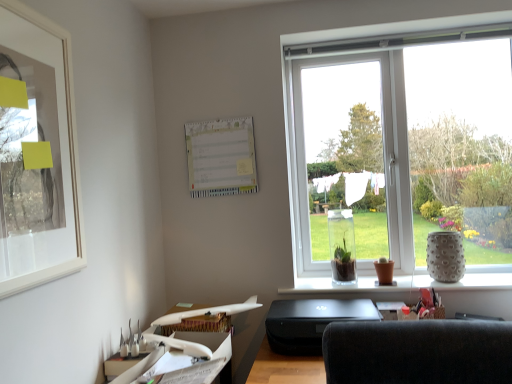
Question: Can you confirm if white plastic airplane at lower left is smaller than speckled ceramic vase at right?

Choices:
 (A) yes
 (B) no

Answer: (B)

Question: Is white plastic airplane at lower left in contact with speckled ceramic vase at right?

Choices:
 (A) no
 (B) yes

Answer: (A)

Question: Is white plastic airplane at lower left taller than speckled ceramic vase at right?

Choices:
 (A) yes
 (B) no

Answer: (B)

Question: Is white plastic airplane at lower left turned away from speckled ceramic vase at right?

Choices:
 (A) no
 (B) yes

Answer: (A)

Question: From a real-world perspective, is white plastic airplane at lower left located beneath speckled ceramic vase at right?

Choices:
 (A) no
 (B) yes

Answer: (B)

Question: From a real-world perspective, is white plastic airplane at lower left positioned above or below black matte printer at lower center?

Choices:
 (A) above
 (B) below

Answer: (B)

Question: In the image, is white plastic airplane at lower left positioned in front of or behind black matte printer at lower center?

Choices:
 (A) behind
 (B) front

Answer: (B)

Question: Looking at the image, does white plastic airplane at lower left seem bigger or smaller compared to black matte printer at lower center?

Choices:
 (A) big
 (B) small

Answer: (B)

Question: Choose the correct answer: Is white plastic airplane at lower left inside black matte printer at lower center or outside it?

Choices:
 (A) outside
 (B) inside

Answer: (A)

Question: Considering the positions of point (442, 281) and point (187, 377), is point (442, 281) closer or farther from the camera than point (187, 377)?

Choices:
 (A) closer
 (B) farther

Answer: (B)

Question: Considering the positions of speckled ceramic vase at right and white plastic airplane at lower left in the image, is speckled ceramic vase at right bigger or smaller than white plastic airplane at lower left?

Choices:
 (A) big
 (B) small

Answer: (B)

Question: Considering the positions of speckled ceramic vase at right and white plastic airplane at lower left in the image, is speckled ceramic vase at right wider or thinner than white plastic airplane at lower left?

Choices:
 (A) thin
 (B) wide

Answer: (A)

Question: Is speckled ceramic vase at right in front of or behind white plastic airplane at lower left in the image?

Choices:
 (A) behind
 (B) front

Answer: (A)

Question: Visually, is white matte picture frame at upper left positioned to the left or to the right of black matte printer at lower center?

Choices:
 (A) right
 (B) left

Answer: (B)

Question: In terms of height, does white matte picture frame at upper left look taller or shorter compared to black matte printer at lower center?

Choices:
 (A) short
 (B) tall

Answer: (B)